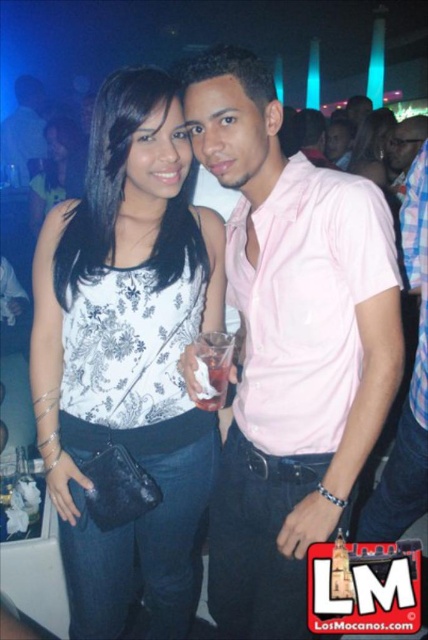
Identify the location of pink cotton shirt at center. (290, 344).

How much distance is there between pink cotton shirt at center and white printed tank top at center?

pink cotton shirt at center is 9.39 inches away from white printed tank top at center.

Which is behind, point (338, 404) or point (163, 467)?

Point (163, 467)

Image resolution: width=428 pixels, height=640 pixels. Find the location of `pink cotton shirt at center`. pink cotton shirt at center is located at coordinates (290, 344).

From the picture: Does matte white tank top at center appear on the right side of matte black purse at center?

In fact, matte white tank top at center is to the left of matte black purse at center.

Is point (41, 196) closer to camera compared to point (359, 164)?

No, (41, 196) is behind (359, 164).

Where is `matte white tank top at center`? This screenshot has width=428, height=640. matte white tank top at center is located at coordinates (58, 170).

From the picture: Can you confirm if pink cotton shirt at center is shorter than pink matte shirt at center?

No, pink cotton shirt at center is not shorter than pink matte shirt at center.

Who is more distant from viewer, [306,404] or [300,109]?

The point [300,109] is more distant.

Between point (285, 182) and point (317, 120), which one is positioned behind?

The point (317, 120) is behind.

The height and width of the screenshot is (640, 428). Identify the location of pink cotton shirt at center. (290, 344).